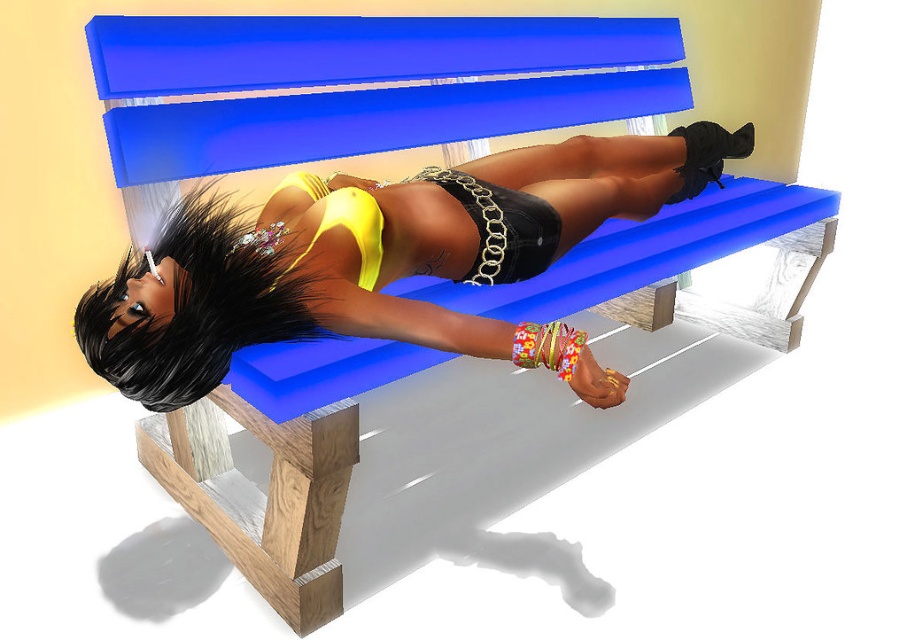
Question: Does matte yellow bikini top at center appear on the left side of yellow satin bikini top at center?

Choices:
 (A) no
 (B) yes

Answer: (A)

Question: Which point appears closest to the camera in this image?

Choices:
 (A) (464, 252)
 (B) (515, 328)

Answer: (B)

Question: Does yellow satin bikini top at center have a smaller size compared to floral fabric underwear at lower center?

Choices:
 (A) yes
 (B) no

Answer: (B)

Question: Which point is closer to the camera?

Choices:
 (A) (525, 332)
 (B) (109, 349)

Answer: (B)

Question: Which of these objects is positioned farthest from the yellow satin bikini top at center?

Choices:
 (A) floral fabric underwear at lower center
 (B) matte yellow bikini top at center

Answer: (A)

Question: In this image, where is yellow satin bikini top at center located relative to floral fabric underwear at lower center?

Choices:
 (A) below
 (B) above

Answer: (B)